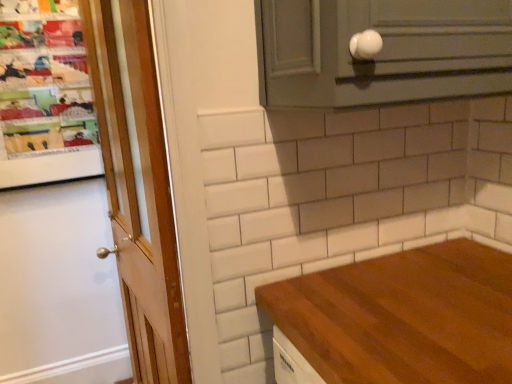
Question: Does white glossy knob at upper right have a lesser width compared to wooden door at left?

Choices:
 (A) no
 (B) yes

Answer: (A)

Question: From a real-world perspective, is white glossy knob at upper right physically below wooden door at left?

Choices:
 (A) yes
 (B) no

Answer: (B)

Question: Is wooden door at left inside white glossy knob at upper right?

Choices:
 (A) yes
 (B) no

Answer: (B)

Question: From the image's perspective, is white glossy knob at upper right located beneath wooden door at left?

Choices:
 (A) no
 (B) yes

Answer: (A)

Question: From the image's perspective, is white glossy knob at upper right located above wooden door at left?

Choices:
 (A) yes
 (B) no

Answer: (A)

Question: Can you confirm if white glossy knob at upper right is shorter than wooden door at left?

Choices:
 (A) yes
 (B) no

Answer: (A)

Question: From a real-world perspective, is wooden door at left beneath white glossy knob at upper right?

Choices:
 (A) no
 (B) yes

Answer: (B)

Question: Is wooden door at left to the left of white glossy knob at upper right from the viewer's perspective?

Choices:
 (A) yes
 (B) no

Answer: (A)

Question: Can white glossy knob at upper right be found inside wooden door at left?

Choices:
 (A) no
 (B) yes

Answer: (A)

Question: From the image's perspective, is wooden door at left over white glossy knob at upper right?

Choices:
 (A) no
 (B) yes

Answer: (A)

Question: Considering the relative sizes of wooden door at left and white glossy knob at upper right in the image provided, is wooden door at left thinner than white glossy knob at upper right?

Choices:
 (A) yes
 (B) no

Answer: (A)

Question: Does wooden door at left have a greater height compared to white glossy knob at upper right?

Choices:
 (A) no
 (B) yes

Answer: (B)

Question: In terms of height, does white glossy knob at upper right look taller or shorter compared to wooden door at left?

Choices:
 (A) short
 (B) tall

Answer: (A)